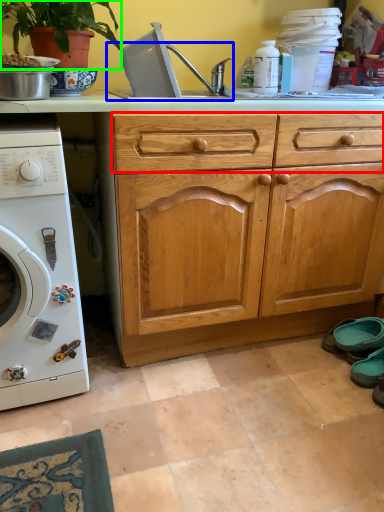
Question: Considering the real-world distances, which object is closest to drawer (highlighted by a red box)? sink (highlighted by a blue box) or houseplant (highlighted by a green box).

Choices:
 (A) sink
 (B) houseplant

Answer: (A)